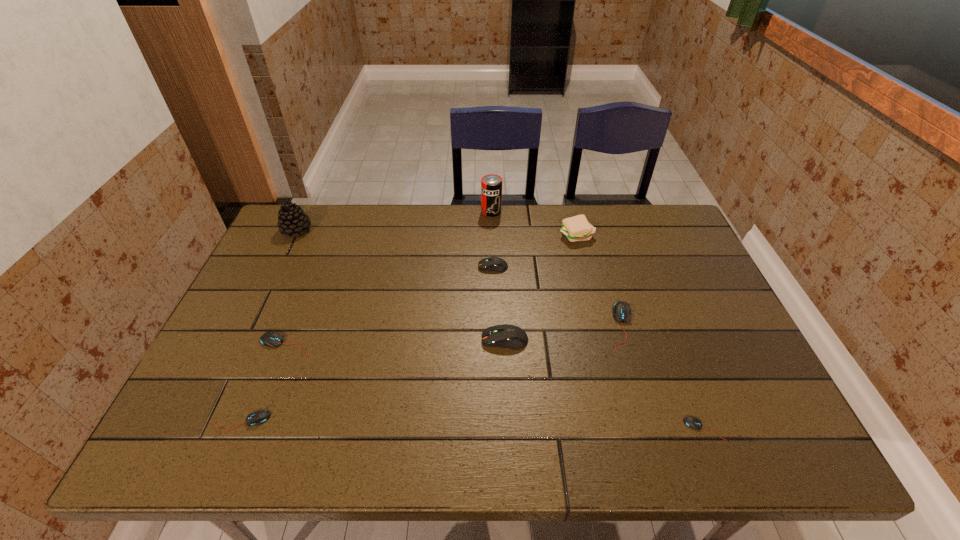
The height and width of the screenshot is (540, 960). I want to click on free spot located on the button of the bigger dark computer equipment, so click(370, 340).

Locate an element on the screen. vacant space located on the button of the bigger dark computer equipment is located at coordinates (334, 340).

Find the location of a particular element. The height and width of the screenshot is (540, 960). vacant space situated 0.340m on the button of the fifth tallest object is located at coordinates (366, 267).

This screenshot has height=540, width=960. What are the coordinates of `vacant point located 0.100m on the button of the fifth tallest object` in the screenshot? It's located at (445, 267).

Identify the location of free region located on the button of the fifth tallest object. Image resolution: width=960 pixels, height=540 pixels. (379, 267).

Find the location of a particular element. This screenshot has width=960, height=540. free space located 0.250m on the back of the biggest black mouse is located at coordinates (598, 245).

The height and width of the screenshot is (540, 960). Find the location of `blank space located 0.070m on the front of the fourth tallest mouse`. blank space located 0.070m on the front of the fourth tallest mouse is located at coordinates (x=272, y=380).

This screenshot has width=960, height=540. I want to click on free space located 0.260m on the back of the fifth tallest mouse, so click(283, 323).

Identify the location of vacant space located on the back of the shortest object. The image size is (960, 540). (658, 310).

Identify the location of can present at the far edge. The height and width of the screenshot is (540, 960). (491, 185).